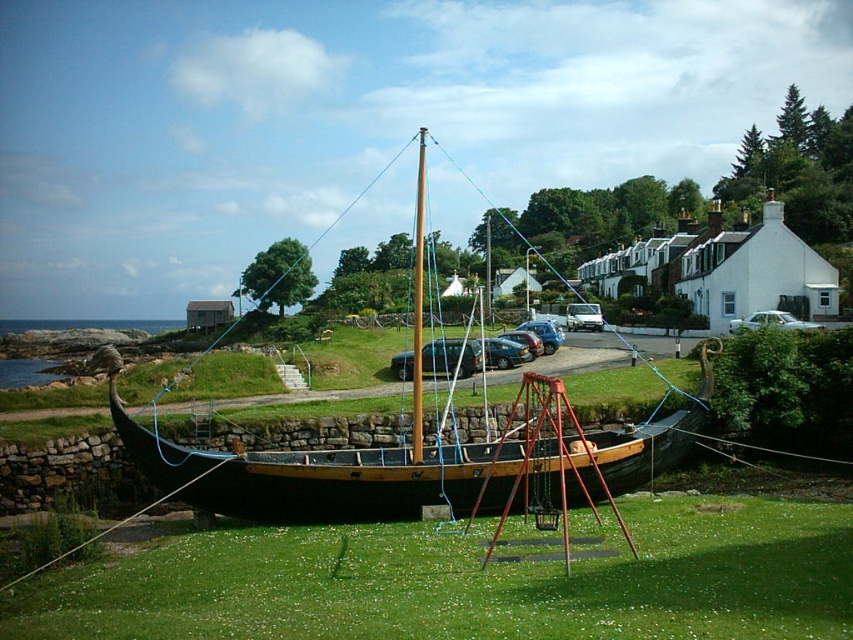
You are standing at the center of the image and want to walk to the green grass at lower center. Which direction should you move in?

You should move downward because the green grass at lower center is located below your current position at the center of the image.

Looking at this image, you are a delivery person trying to park your truck, which is 2 meters tall, in the parking area near the houses. The wooden sailboat at center and the white matte sedan at center are blocking the entrance. Can your truck pass between them?

The wooden sailboat at center is taller than the white matte sedan at center. Since the truck is 2 meters tall, and the sailboat is taller than the sedan, it depends on the sedan height. If the sedan is under 2 meters, the truck might pass. But without exact heights, we can only say the sailboat is taller, so the sedan could be shorter.

You are standing at the origin point of the coordinate system in this coastal scene. The wooden sailboat at center is your destination. What are the coordinates you need to navigate to reach it?

The wooden sailboat at center is located at coordinates 0.733 in the x direction and 0.482 in the y direction.